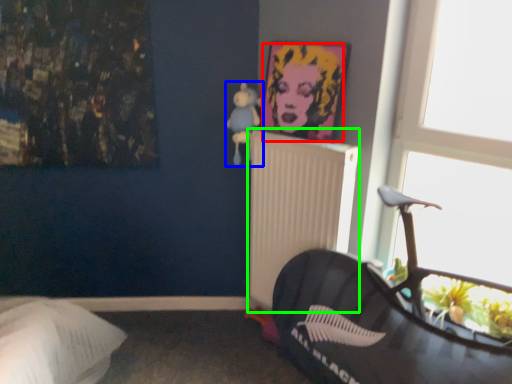
Question: Considering the real-world distances, which object is farthest from person (highlighted by a red box)? toy (highlighted by a blue box) or radiator (highlighted by a green box)?

Choices:
 (A) toy
 (B) radiator

Answer: (B)